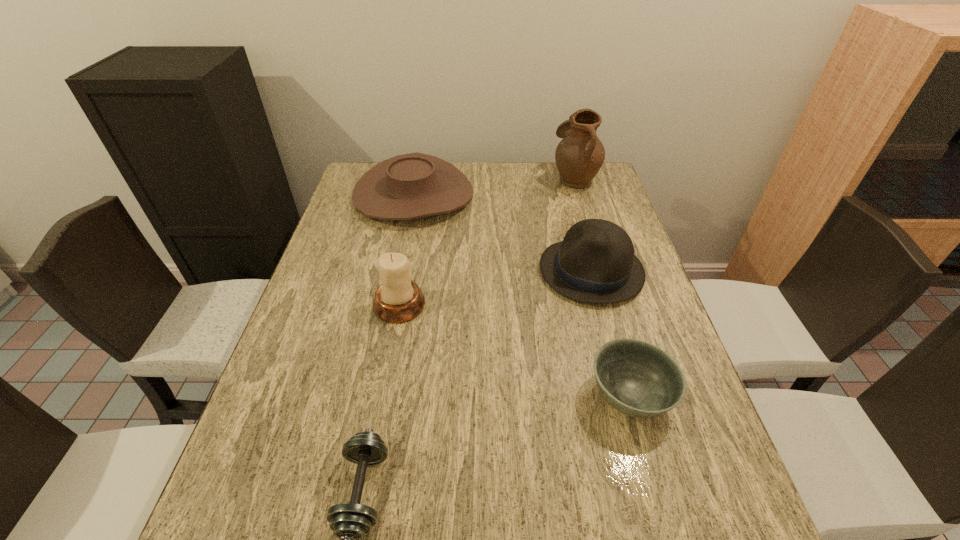
Locate an element on the screen. The image size is (960, 540). vacant space that is in between the candle holder and the third shortest object is located at coordinates (406, 249).

Identify the location of free space between the cowboy hat and the third tallest object. (502, 232).

Select which object is the fifth closest to the dumbbell. Please provide its 2D coordinates. Your answer should be formatted as a tuple, i.e. [(x, y)], where the tuple contains the x and y coordinates of a point satisfying the conditions above.

[(579, 156)]

Identify which object is located as the second nearest to the candle holder. Please provide its 2D coordinates. Your answer should be formatted as a tuple, i.e. [(x, y)], where the tuple contains the x and y coordinates of a point satisfying the conditions above.

[(350, 522)]

Image resolution: width=960 pixels, height=540 pixels. I want to click on free location that satisfies the following two spatial constraints: 1. on the front-facing side of the bowler hat; 2. on the right side of the fifth farthest object, so click(x=626, y=396).

Where is `free spot that satisfies the following two spatial constraints: 1. on the front side of the candle holder; 2. on the right side of the third shortest object`? The height and width of the screenshot is (540, 960). free spot that satisfies the following two spatial constraints: 1. on the front side of the candle holder; 2. on the right side of the third shortest object is located at coordinates (392, 305).

Image resolution: width=960 pixels, height=540 pixels. In order to click on vacant space that satisfies the following two spatial constraints: 1. on the front side of the bowl; 2. on the right side of the candle holder in this screenshot , I will do `click(382, 396)`.

Where is `vacant area in the image that satisfies the following two spatial constraints: 1. on the front side of the candle holder; 2. on the right side of the second nearest object`? This screenshot has height=540, width=960. vacant area in the image that satisfies the following two spatial constraints: 1. on the front side of the candle holder; 2. on the right side of the second nearest object is located at coordinates (382, 396).

Find the location of a particular element. This screenshot has height=540, width=960. free space that satisfies the following two spatial constraints: 1. at the spout of the pitcher; 2. on the front side of the bowl is located at coordinates (640, 396).

In order to click on vacant region that satisfies the following two spatial constraints: 1. on the front side of the third shortest object; 2. on the left side of the bowl in this screenshot , I will do `click(373, 396)`.